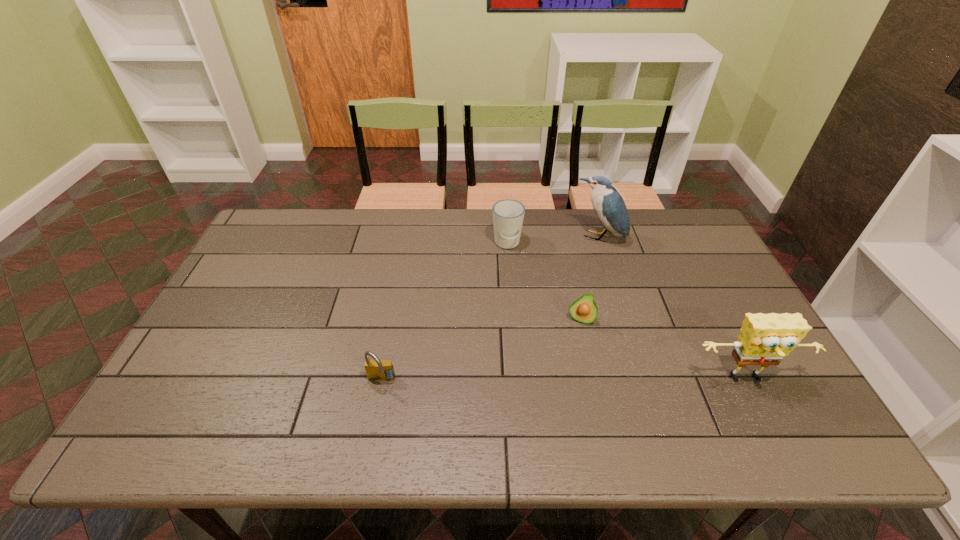
Find the location of a particular element. Image resolution: width=960 pixels, height=540 pixels. the leftmost object is located at coordinates (376, 369).

Find the location of a particular element. sponge is located at coordinates (764, 339).

Locate an element on the screen. bird is located at coordinates (608, 204).

I want to click on cup, so click(508, 215).

Identify the location of the second object from left to right. The height and width of the screenshot is (540, 960). (508, 215).

You are a GUI agent. You are given a task and a screenshot of the screen. Output one action in this format:
    pyautogui.click(x=<x>, y=<y>)
    Task: Click on the third nearest object
    This screenshot has width=960, height=540.
    Given the screenshot: What is the action you would take?
    pyautogui.click(x=584, y=310)

Identify the location of vacant area situated at the tip of the bird's beak. This screenshot has height=540, width=960. (567, 291).

Where is `vacant region located at the tip of the bird's beak`? This screenshot has width=960, height=540. vacant region located at the tip of the bird's beak is located at coordinates (584, 257).

Identify the location of free space located 0.330m at the tip of the bird's beak. (556, 313).

You are a GUI agent. You are given a task and a screenshot of the screen. Output one action in this format:
    pyautogui.click(x=<x>, y=<y>)
    Task: Click on the vacant space situated 0.230m with a handle on the side of the fourth object from right to left
    The width and height of the screenshot is (960, 540).
    Given the screenshot: What is the action you would take?
    pyautogui.click(x=509, y=307)